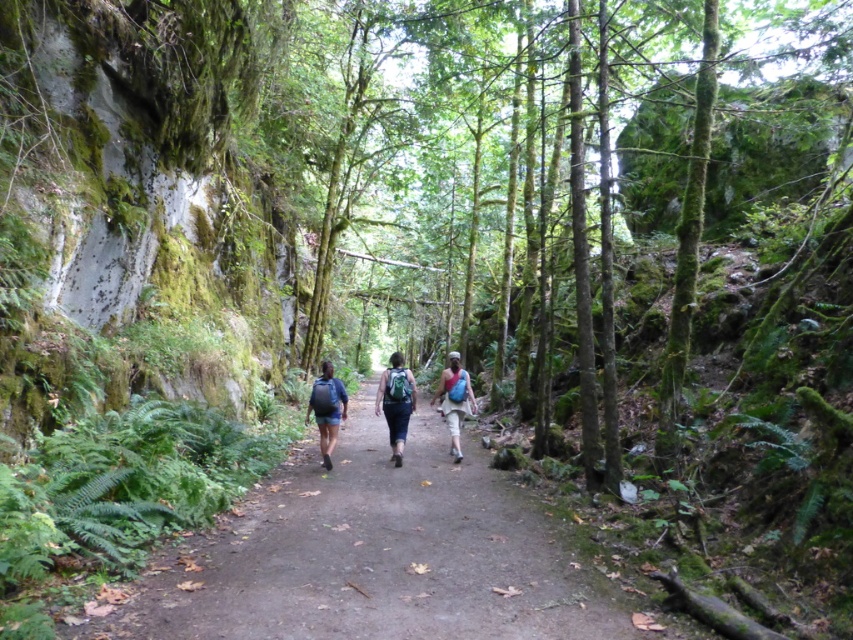
Consider the image. You are a hiker who has just spotted two backpacks on the forest trail. The scene shows a matte blue backpacks at center and a blue fabric backpack at center. Which backpack is positioned to the left of the other?

The matte blue backpacks at center is to the left of the blue fabric backpack at center.

You are a hiker who wants to place a new backpack on the forest trail. You see the matte blue backpacks at center and the matte blue backpack at center. Which one is positioned lower on the trail?

The matte blue backpacks at center is located below the matte blue backpack at center, so it is positioned lower on the trail.